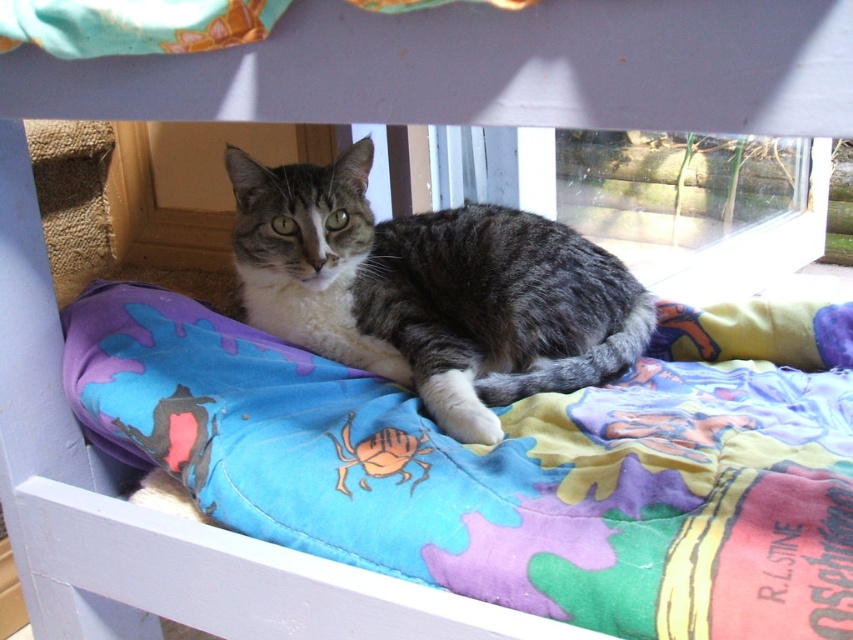
Question: Among these objects, which one is nearest to the camera?

Choices:
 (A) gray tabby cat at center
 (B) multicolored quilted blanket at center

Answer: (B)

Question: Which point is farther to the camera?

Choices:
 (A) (422, 524)
 (B) (271, 304)

Answer: (B)

Question: Which object appears closest to the camera in this image?

Choices:
 (A) gray tabby cat at center
 (B) multicolored quilted blanket at center

Answer: (B)

Question: Does multicolored quilted blanket at center have a lesser width compared to gray tabby cat at center?

Choices:
 (A) no
 (B) yes

Answer: (A)

Question: Is multicolored quilted blanket at center further to the viewer compared to gray tabby cat at center?

Choices:
 (A) no
 (B) yes

Answer: (A)

Question: Does multicolored quilted blanket at center appear over gray tabby cat at center?

Choices:
 (A) no
 (B) yes

Answer: (A)